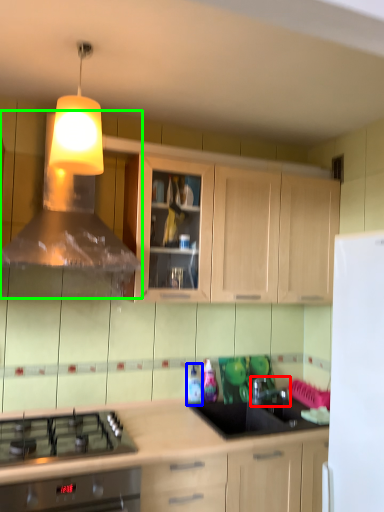
Question: Which object is the closest to the tap (highlighted by a red box)? Choose among these: bottle (highlighted by a blue box) or vent (highlighted by a green box).

Choices:
 (A) bottle
 (B) vent

Answer: (A)